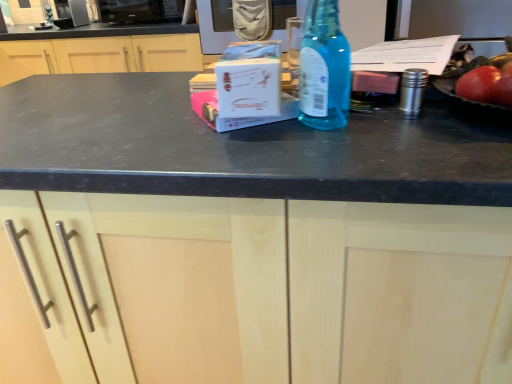
Locate an element on the screen. The image size is (512, 384). blue glass bottle at center is located at coordinates (324, 68).

How much space does satin silver microwave at upper left, the 2th appliance when ordered from right to left, occupy horizontally?

satin silver microwave at upper left, the 2th appliance when ordered from right to left, is 10.96 inches wide.

The height and width of the screenshot is (384, 512). Describe the element at coordinates (69, 13) in the screenshot. I see `satin silver microwave at upper left, the 1th appliance viewed from the left` at that location.

The width and height of the screenshot is (512, 384). Find the location of `matte wood cabinet at center, which appears as the second cabinetry when ordered from the bottom`. matte wood cabinet at center, which appears as the second cabinetry when ordered from the bottom is located at coordinates 100,55.

What are the coordinates of `black matte microwave at upper center, which ranks as the 2th appliance in left-to-right order` in the screenshot? It's located at click(x=140, y=11).

From the image's perspective, is matte wood cabinet at center, the second cabinetry viewed from the top, above or below satin silver microwave at upper left, the 1th appliance viewed from the left?

matte wood cabinet at center, the second cabinetry viewed from the top, is below satin silver microwave at upper left, the 1th appliance viewed from the left.

Which object is more forward, matte wood cabinet at center, the first cabinetry from the bottom, or satin silver microwave at upper left, the 2th appliance when ordered from right to left?

matte wood cabinet at center, the first cabinetry from the bottom.

Identify the location of appliance that is the 2nd one above the matte wood cabinet at center, which is the 1th cabinetry in front-to-back order (from a real-world perspective). The width and height of the screenshot is (512, 384). (69, 13).

From a real-world perspective, does matte wood cabinet at center, which is the second cabinetry in back-to-front order, stand above satin silver microwave at upper left, the 2th appliance when ordered from right to left?

Actually, matte wood cabinet at center, which is the second cabinetry in back-to-front order, is physically below satin silver microwave at upper left, the 2th appliance when ordered from right to left, in the real world.

Does black matte microwave at upper center, which is the first appliance from right to left, have a lesser height compared to blue glass bottle at center?

Yes, black matte microwave at upper center, which is the first appliance from right to left, is shorter than blue glass bottle at center.

Can you see black matte microwave at upper center, which is the first appliance from right to left, touching blue glass bottle at center?

They are not placed beside each other.

From a real-world perspective, is black matte microwave at upper center, which ranks as the 2th appliance in left-to-right order, below blue glass bottle at center?

Yes.

Where is `appliance that is the 1st object located behind the blue glass bottle at center`? The image size is (512, 384). appliance that is the 1st object located behind the blue glass bottle at center is located at coordinates (140, 11).

Considering the relative sizes of satin silver microwave at upper left, the 1th appliance viewed from the left, and matte wood cabinet at center, which appears as the second cabinetry when ordered from the bottom, in the image provided, is satin silver microwave at upper left, the 1th appliance viewed from the left, shorter than matte wood cabinet at center, which appears as the second cabinetry when ordered from the bottom,?

Yes.

In the scene shown: From the image's perspective, is satin silver microwave at upper left, the 1th appliance viewed from the left, on top of matte wood cabinet at center, acting as the first cabinetry starting from the back?

Yes.

Is satin silver microwave at upper left, the 1th appliance viewed from the left, inside or outside of matte wood cabinet at center, acting as the 1th cabinetry starting from the top?

The correct answer is: outside.

Does point (71, 25) appear closer or farther from the camera than point (314, 115)?

Point (71, 25) is positioned farther from the camera compared to point (314, 115).

In the scene shown: Considering the positions of objects satin silver microwave at upper left, the 1th appliance viewed from the left, and blue glass bottle at center in the image provided, who is behind, satin silver microwave at upper left, the 1th appliance viewed from the left, or blue glass bottle at center?

satin silver microwave at upper left, the 1th appliance viewed from the left, is behind.

Is satin silver microwave at upper left, the 2th appliance when ordered from right to left, thinner than blue glass bottle at center?

No, satin silver microwave at upper left, the 2th appliance when ordered from right to left, is not thinner than blue glass bottle at center.

Considering the sizes of matte wood cabinet at center, which appears as the second cabinetry when ordered from the bottom, and black matte microwave at upper center, which is the first appliance from right to left, in the image, is matte wood cabinet at center, which appears as the second cabinetry when ordered from the bottom, taller or shorter than black matte microwave at upper center, which is the first appliance from right to left,?

Clearly, matte wood cabinet at center, which appears as the second cabinetry when ordered from the bottom, is taller compared to black matte microwave at upper center, which is the first appliance from right to left.

Does matte wood cabinet at center, acting as the second cabinetry starting from the front, have a greater width compared to black matte microwave at upper center, which ranks as the 2th appliance in left-to-right order?

Yes, matte wood cabinet at center, acting as the second cabinetry starting from the front, is wider than black matte microwave at upper center, which ranks as the 2th appliance in left-to-right order.

Between matte wood cabinet at center, acting as the 1th cabinetry starting from the top, and black matte microwave at upper center, which is the first appliance from right to left, which one appears on the left side from the viewer's perspective?

matte wood cabinet at center, acting as the 1th cabinetry starting from the top, is more to the left.

Is matte wood cabinet at center, which appears as the second cabinetry when ordered from the bottom, touching black matte microwave at upper center, which ranks as the 2th appliance in left-to-right order?

No.

Is matte wood cabinet at center, the first cabinetry from the bottom, positioned beyond the bounds of black matte microwave at upper center, which ranks as the 2th appliance in left-to-right order?

Yes.

How distant is matte wood cabinet at center, the second cabinetry viewed from the top, from black matte microwave at upper center, which is the first appliance from right to left?

matte wood cabinet at center, the second cabinetry viewed from the top, is 6.73 feet away from black matte microwave at upper center, which is the first appliance from right to left.

Locate an element on the screen. The image size is (512, 384). cabinetry that is the 2nd one when counting downward from the black matte microwave at upper center, which ranks as the 2th appliance in left-to-right order (from the image's perspective) is located at coordinates (268, 289).

Can you confirm if matte wood cabinet at center, the second cabinetry viewed from the top, is bigger than black matte microwave at upper center, which ranks as the 2th appliance in left-to-right order?

Yes, matte wood cabinet at center, the second cabinetry viewed from the top, is bigger than black matte microwave at upper center, which ranks as the 2th appliance in left-to-right order.

Is point (37, 51) closer to viewer compared to point (81, 21)?

No, it is not.

Is matte wood cabinet at center, acting as the 1th cabinetry starting from the top, facing away from satin silver microwave at upper left, the 2th appliance when ordered from right to left?

No, satin silver microwave at upper left, the 2th appliance when ordered from right to left, is not at the back of matte wood cabinet at center, acting as the 1th cabinetry starting from the top.

From a real-world perspective, is matte wood cabinet at center, acting as the first cabinetry starting from the back, physically below satin silver microwave at upper left, the 1th appliance viewed from the left?

Yes.

Locate an element on the screen. This screenshot has width=512, height=384. appliance that is the 2nd object to the left of the matte wood cabinet at center, which is the second cabinetry in back-to-front order, starting at the anchor is located at coordinates (69, 13).

From the image's perspective, starting from the blue glass bottle at center, which appliance is the 1st one above? Please provide its 2D coordinates.

[(140, 11)]

Based on their spatial positions, is matte wood cabinet at center, which appears as the second cabinetry when ordered from the bottom, or matte wood cabinet at center, which is the second cabinetry in back-to-front order, closer to black matte microwave at upper center, which is the first appliance from right to left?

matte wood cabinet at center, which appears as the second cabinetry when ordered from the bottom, is positioned closer to the anchor black matte microwave at upper center, which is the first appliance from right to left.

When comparing their distances from satin silver microwave at upper left, the 2th appliance when ordered from right to left, does blue glass bottle at center or matte wood cabinet at center, the second cabinetry viewed from the top, seem further?

matte wood cabinet at center, the second cabinetry viewed from the top, is further to satin silver microwave at upper left, the 2th appliance when ordered from right to left.

Which object lies nearer to the anchor point black matte microwave at upper center, which ranks as the 2th appliance in left-to-right order, matte wood cabinet at center, which is the 1th cabinetry in front-to-back order, or matte wood cabinet at center, which appears as the second cabinetry when ordered from the bottom?

Among the two, matte wood cabinet at center, which appears as the second cabinetry when ordered from the bottom, is located nearer to black matte microwave at upper center, which ranks as the 2th appliance in left-to-right order.

Estimate the real-world distances between objects in this image. Which object is closer to matte wood cabinet at center, which is the second cabinetry in back-to-front order, matte wood cabinet at center, acting as the first cabinetry starting from the back, or black matte microwave at upper center, which is the first appliance from right to left?

Based on the image, matte wood cabinet at center, acting as the first cabinetry starting from the back, appears to be nearer to matte wood cabinet at center, which is the second cabinetry in back-to-front order.

Which object lies nearer to the anchor point satin silver microwave at upper left, the 2th appliance when ordered from right to left, blue glass bottle at center or matte wood cabinet at center, acting as the 1th cabinetry starting from the top?

matte wood cabinet at center, acting as the 1th cabinetry starting from the top, is positioned closer to the anchor satin silver microwave at upper left, the 2th appliance when ordered from right to left.

Estimate the real-world distances between objects in this image. Which object is closer to black matte microwave at upper center, which ranks as the 2th appliance in left-to-right order, matte wood cabinet at center, acting as the first cabinetry starting from the back, or satin silver microwave at upper left, the 2th appliance when ordered from right to left?

matte wood cabinet at center, acting as the first cabinetry starting from the back, is closer to black matte microwave at upper center, which ranks as the 2th appliance in left-to-right order.

From the image, which object appears to be farther from matte wood cabinet at center, acting as the 1th cabinetry starting from the top, blue glass bottle at center or black matte microwave at upper center, which ranks as the 2th appliance in left-to-right order?

Based on the image, blue glass bottle at center appears to be further to matte wood cabinet at center, acting as the 1th cabinetry starting from the top.

Considering their positions, is black matte microwave at upper center, which is the first appliance from right to left, positioned closer to blue glass bottle at center than matte wood cabinet at center, which appears as the second cabinetry when ordered from the bottom?

matte wood cabinet at center, which appears as the second cabinetry when ordered from the bottom.

What are the coordinates of `cabinetry between matte wood cabinet at center, the first cabinetry from the bottom, and satin silver microwave at upper left, the 1th appliance viewed from the left, from front to back` in the screenshot? It's located at (100, 55).

This screenshot has width=512, height=384. In order to click on bottle between matte wood cabinet at center, which is the second cabinetry in back-to-front order, and black matte microwave at upper center, which is the first appliance from right to left, along the z-axis in this screenshot , I will do `click(324, 68)`.

Where is `appliance between matte wood cabinet at center, the second cabinetry viewed from the top, and satin silver microwave at upper left, the 2th appliance when ordered from right to left, in the front-back direction`? The width and height of the screenshot is (512, 384). appliance between matte wood cabinet at center, the second cabinetry viewed from the top, and satin silver microwave at upper left, the 2th appliance when ordered from right to left, in the front-back direction is located at coordinates (140, 11).

At what (x,y) coordinates should I click in order to perform the action: click on cabinetry located between blue glass bottle at center and black matte microwave at upper center, which ranks as the 2th appliance in left-to-right order, in the depth direction. Please return your answer as a coordinate pair (x, y). Looking at the image, I should click on (100, 55).